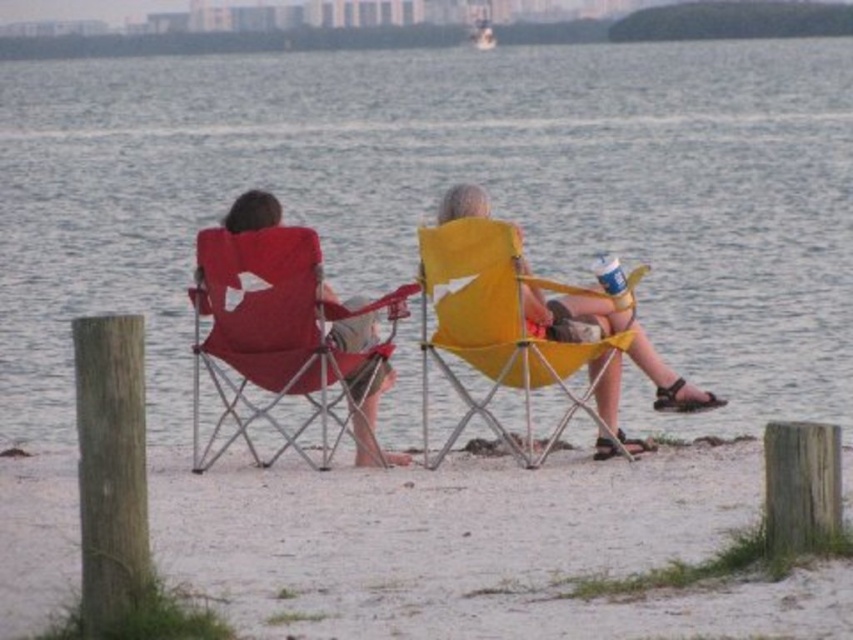
You are standing at the origin point in the image. There is a blue water at center at point [440,193]. If you want to walk towards the blue water at center, which direction should you head?

The blue water at center is located at point [440,193], so you should head towards the center of the image to reach it.

In the scene shown: You are planning to set up a small tent for shade between the white sand at center and the yellow fabric beach chair at center. Given their sizes, which object should you place the tent closer to to ensure it doesn

The white sand at center has a smaller size compared to the yellow fabric beach chair at center, so you should place the tent closer to the white sand at center to ensure it doesn